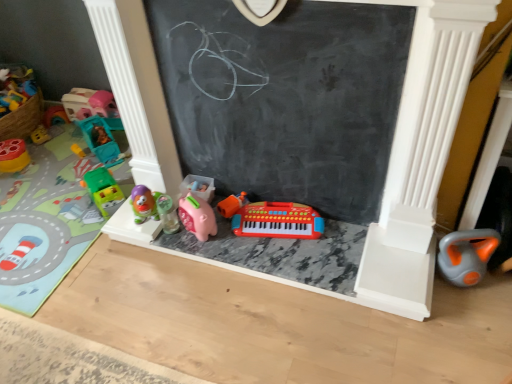
Where is `free space in front of translucent plastic toy at center, acting as the third toy starting from the right`? The height and width of the screenshot is (384, 512). free space in front of translucent plastic toy at center, acting as the third toy starting from the right is located at coordinates (179, 244).